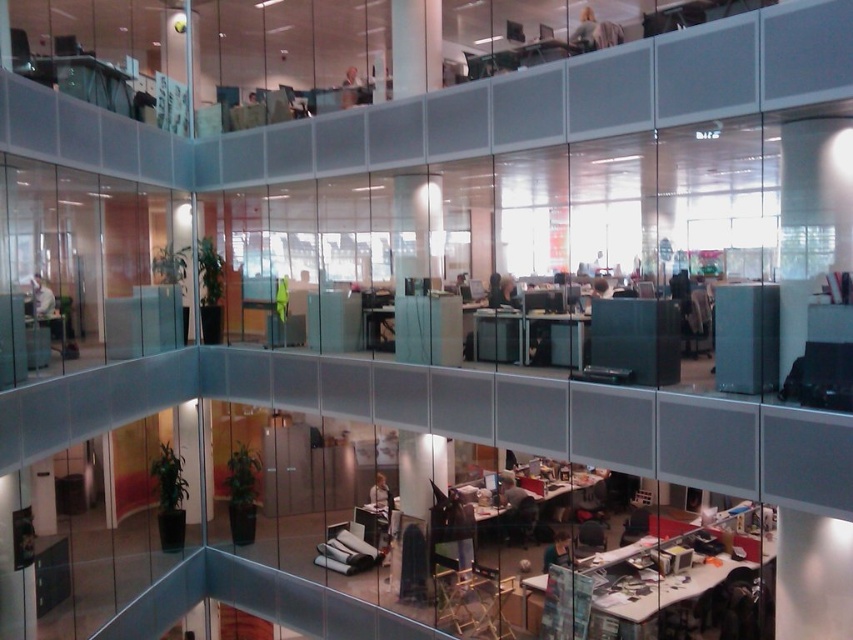
Question: Among these objects, which one is nearest to the camera?

Choices:
 (A) metallic silver chair at lower center
 (B) matte black chair at lower center

Answer: (A)

Question: Which object is positioned closest to the matte black chair at lower center?

Choices:
 (A) metallic silver chair at lower center
 (B) metallic gray chair at lower right

Answer: (B)

Question: Can you confirm if metallic silver chair at lower center is wider than metallic gray chair at lower right?

Choices:
 (A) no
 (B) yes

Answer: (A)

Question: Which of the following is the farthest from the observer?

Choices:
 (A) metallic gray chair at lower right
 (B) metallic silver chair at lower center
 (C) matte black chair at lower center

Answer: (C)

Question: Is metallic silver chair at lower center to the right of black leather chair at lower center from the viewer's perspective?

Choices:
 (A) no
 (B) yes

Answer: (A)

Question: Can you confirm if metallic silver chair at lower center is positioned above black leather chair at lower center?

Choices:
 (A) yes
 (B) no

Answer: (A)